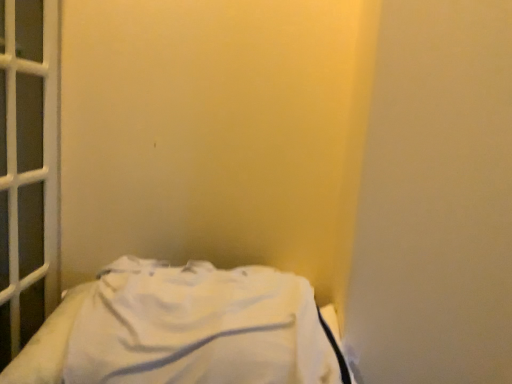
This screenshot has width=512, height=384. What do you see at coordinates (183, 330) in the screenshot?
I see `white fabric bed at lower left` at bounding box center [183, 330].

Locate an element on the screen. This screenshot has height=384, width=512. white fabric bed at lower left is located at coordinates (183, 330).

Measure the distance between point (182, 304) and camera.

They are 34.88 inches apart.

The height and width of the screenshot is (384, 512). I want to click on white fabric bed at lower left, so click(183, 330).